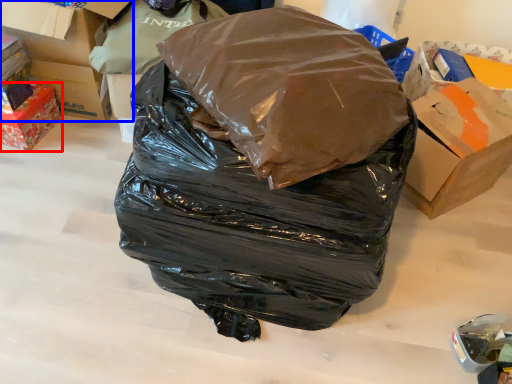
Question: Which point is closer to the camera, box (highlighted by a red box) or box (highlighted by a blue box)?

Choices:
 (A) box
 (B) box

Answer: (A)